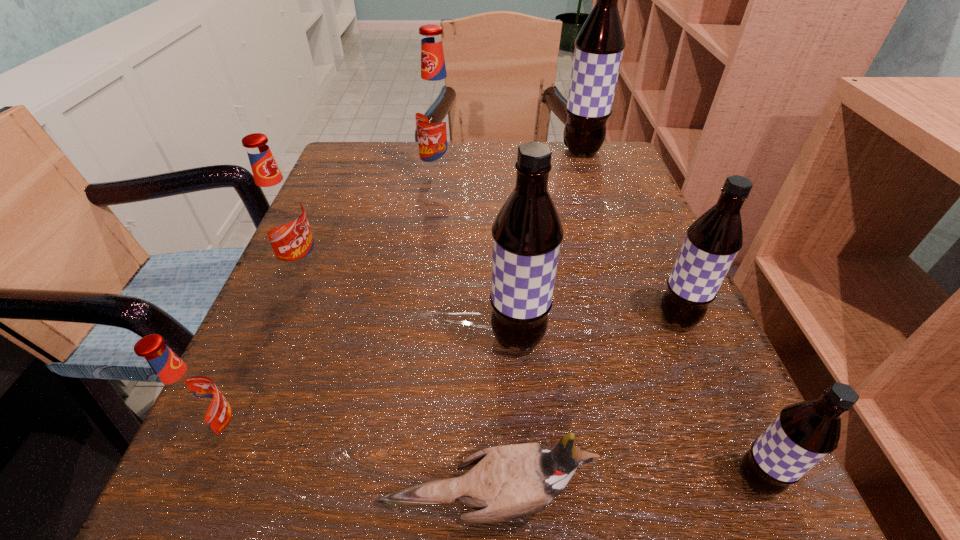
Identify the location of free region located 0.390m on the left of the smallest brown root beer. (389, 480).

Locate an element on the screen. This screenshot has height=540, width=960. free region located 0.150m at the face of the shortest object is located at coordinates (720, 504).

Image resolution: width=960 pixels, height=540 pixels. What are the coordinates of `root beer located in the near edge section of the desktop` in the screenshot? It's located at (804, 433).

Locate an element on the screen. Image resolution: width=960 pixels, height=540 pixels. bird positioned at the near edge is located at coordinates (508, 482).

Find the location of a particular element. object at the far right corner is located at coordinates (599, 46).

Locate an element on the screen. The width and height of the screenshot is (960, 540). object that is at the near right corner is located at coordinates (804, 433).

You are a GUI agent. You are given a task and a screenshot of the screen. Output one action in this format:
    pyautogui.click(x=<x>, y=<y>)
    Task: Click on the vacant space at the far edge of the desktop
    This screenshot has width=960, height=540.
    Given the screenshot: What is the action you would take?
    pyautogui.click(x=508, y=150)

Image resolution: width=960 pixels, height=540 pixels. What are the coordinates of `vacant region at the near edge of the desktop` in the screenshot? It's located at (359, 460).

This screenshot has width=960, height=540. In the image, there is a desktop. What are the coordinates of `vacant space at the left edge` in the screenshot? It's located at (286, 386).

In the image, there is a desktop. Where is `vacant area at the right edge`? The image size is (960, 540). vacant area at the right edge is located at coordinates (693, 360).